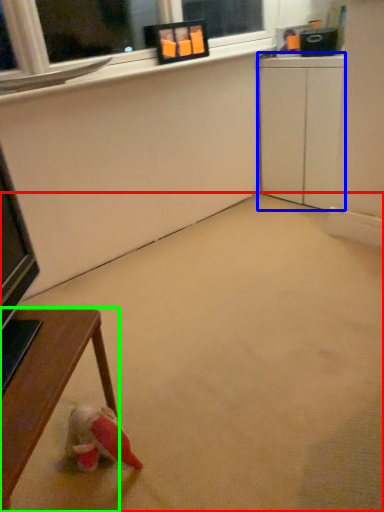
Question: Considering the real-world distances, which object is farthest from concrete (highlighted by a red box)? computer desk (highlighted by a blue box) or table (highlighted by a green box)?

Choices:
 (A) computer desk
 (B) table

Answer: (A)